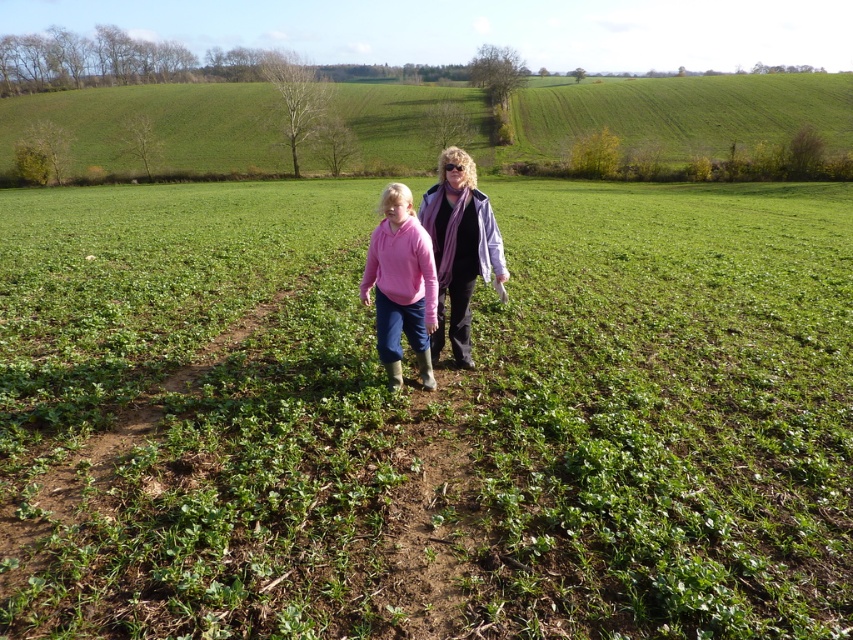
Does green grass at center appear under matte purple scarf at center?

Incorrect, green grass at center is not positioned below matte purple scarf at center.

Which of these two, green grass at center or matte purple scarf at center, stands taller?

green grass at center

Does point (740, 589) come behind point (445, 192)?

That is False.

Where is `green grass at center`? The image size is (853, 640). green grass at center is located at coordinates (425, 419).

Which is above, green grass at center or pink fleece at center?

green grass at center is higher up.

Does green grass at center have a larger size compared to pink fleece at center?

Yes, green grass at center is bigger than pink fleece at center.

Which is in front, point (230, 317) or point (392, 307)?

Point (392, 307) is more forward.

You are a GUI agent. You are given a task and a screenshot of the screen. Output one action in this format:
    pyautogui.click(x=<x>, y=<y>)
    Task: Click on the green grass at center
    The height and width of the screenshot is (640, 853).
    Given the screenshot: What is the action you would take?
    pyautogui.click(x=425, y=419)

Between matte purple scarf at center and pink fleece at center, which one has less height?

pink fleece at center

Can you confirm if matte purple scarf at center is positioned below pink fleece at center?

Incorrect, matte purple scarf at center is not positioned below pink fleece at center.

Is point (421, 209) positioned behind point (405, 266)?

Yes, it is.

The width and height of the screenshot is (853, 640). I want to click on matte purple scarf at center, so click(459, 246).